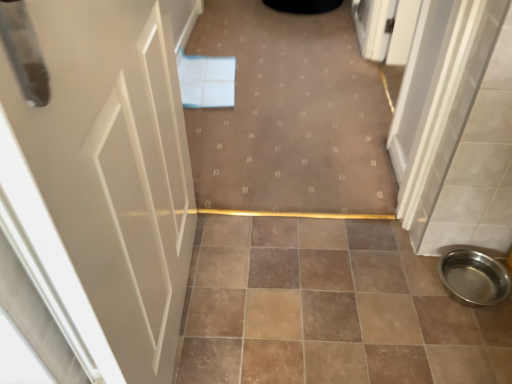
Question: Is white glossy door at left taller or shorter than brown ceramic tile at center?

Choices:
 (A) short
 (B) tall

Answer: (B)

Question: Is white glossy door at left situated inside brown ceramic tile at center or outside?

Choices:
 (A) outside
 (B) inside

Answer: (A)

Question: Based on their relative distances, which object is farther from the white glossy door at left?

Choices:
 (A) carpet at center
 (B) polished stainless steel bowl at lower right
 (C) brown ceramic tile at center

Answer: (B)

Question: Which object is positioned closest to the brown ceramic tile at center?

Choices:
 (A) polished stainless steel bowl at lower right
 (B) carpet at center
 (C) white glossy door at left

Answer: (A)